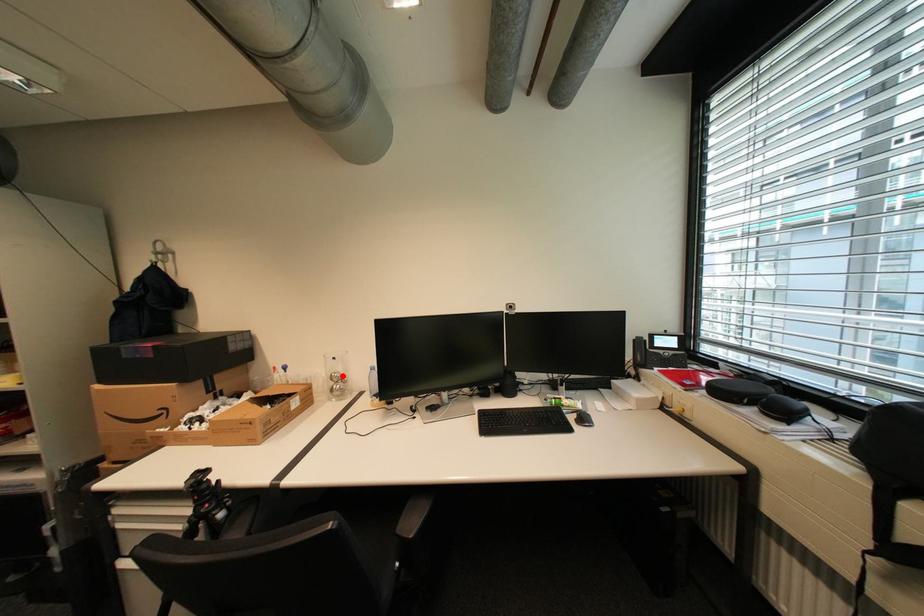
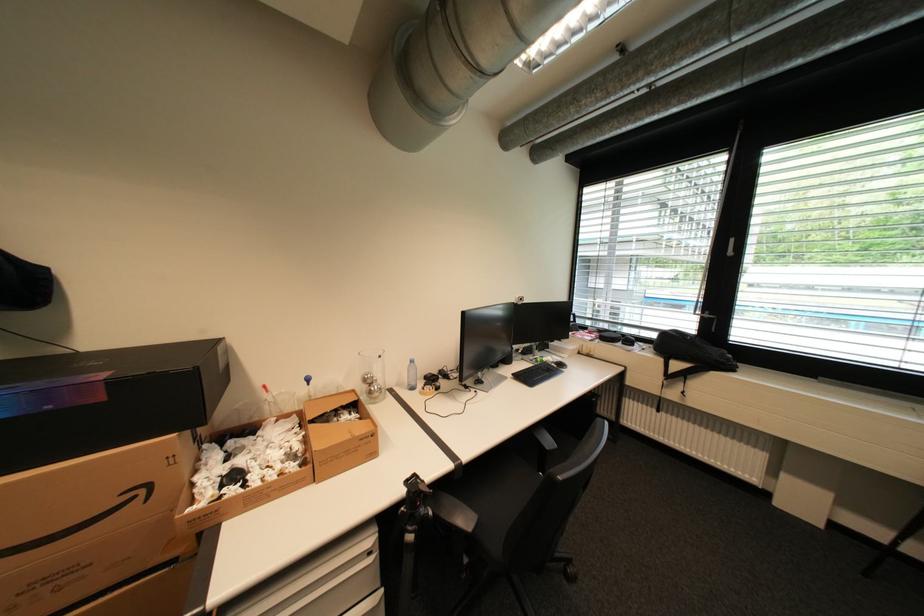
Find the pixel in the second image that matches the highlighted location in the first image.

(377, 378)